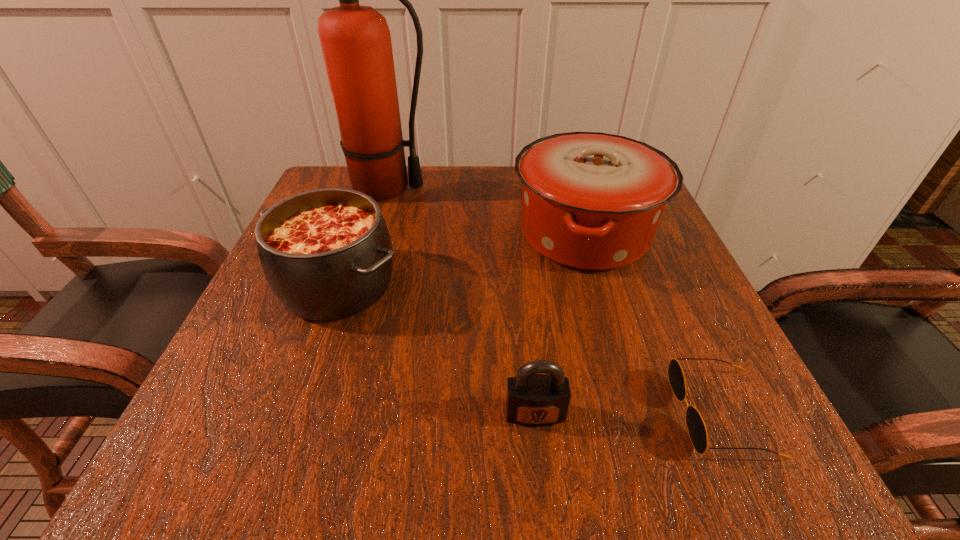
This screenshot has width=960, height=540. I want to click on vacant space that is in between the right casserole and the left casserole, so click(x=461, y=259).

Find the location of a particular element. This screenshot has width=960, height=540. free space that is in between the padlock and the tallest object is located at coordinates (461, 301).

Image resolution: width=960 pixels, height=540 pixels. Identify the location of free point between the right casserole and the third tallest object. (461, 259).

Locate an element on the screen. blank region between the padlock and the taller casserole is located at coordinates (560, 323).

Locate an element on the screen. free area in between the sunglasses and the second shortest object is located at coordinates pyautogui.click(x=628, y=414).

Locate an element on the screen. The image size is (960, 540). free space between the sunglasses and the tallest object is located at coordinates (554, 300).

The width and height of the screenshot is (960, 540). I want to click on free space between the shortest object and the padlock, so click(628, 414).

I want to click on object that ranks as the fourth closest to the taller casserole, so click(x=532, y=399).

Locate an element on the screen. The image size is (960, 540). the second closest object to the left casserole is located at coordinates (592, 201).

Image resolution: width=960 pixels, height=540 pixels. In order to click on vacant region that satisfies the following two spatial constraints: 1. on the nozzle of the fire extinguisher; 2. on the left side of the taller casserole in this screenshot , I will do `click(372, 233)`.